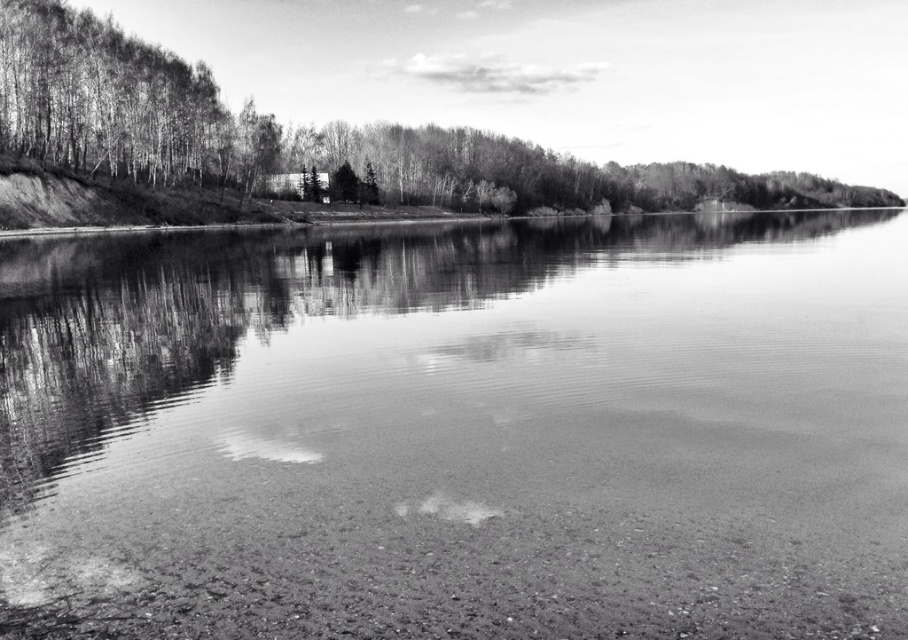
Question: Is smooth water at center to the left of smooth bark tree at upper left from the viewer's perspective?

Choices:
 (A) yes
 (B) no

Answer: (A)

Question: Does smooth water at center have a smaller size compared to smooth bark tree at upper left?

Choices:
 (A) no
 (B) yes

Answer: (B)

Question: Which object is closer to the camera taking this photo?

Choices:
 (A) smooth bark tree at upper left
 (B) smooth water at center

Answer: (B)

Question: Can you confirm if smooth water at center is bigger than smooth bark tree at upper left?

Choices:
 (A) no
 (B) yes

Answer: (A)

Question: Which of the following is the farthest from the observer?

Choices:
 (A) smooth bark tree at upper left
 (B) smooth water at center

Answer: (A)